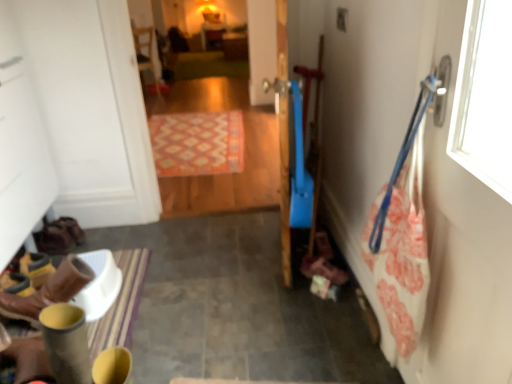
Question: Is wooden chair at upper center thinner than patterned carpet at center?

Choices:
 (A) no
 (B) yes

Answer: (B)

Question: Are wooden chair at upper center and patterned carpet at center located far from each other?

Choices:
 (A) yes
 (B) no

Answer: (A)

Question: From the image's perspective, would you say wooden chair at upper center is positioned over patterned carpet at center?

Choices:
 (A) yes
 (B) no

Answer: (A)

Question: Considering the relative positions of wooden chair at upper center and patterned carpet at center in the image provided, is wooden chair at upper center to the left of patterned carpet at center from the viewer's perspective?

Choices:
 (A) yes
 (B) no

Answer: (A)

Question: Is wooden chair at upper center closer to camera compared to patterned carpet at center?

Choices:
 (A) yes
 (B) no

Answer: (B)

Question: Is wooden chair at upper center placed right next to patterned carpet at center?

Choices:
 (A) no
 (B) yes

Answer: (A)

Question: Is wooden chair at upper center to the left of patterned carpet at center from the viewer's perspective?

Choices:
 (A) yes
 (B) no

Answer: (A)

Question: Is there a large distance between wooden chair at upper center and patterned carpet at center?

Choices:
 (A) no
 (B) yes

Answer: (B)

Question: Can we say wooden chair at upper center lies outside patterned carpet at center?

Choices:
 (A) no
 (B) yes

Answer: (B)

Question: Could you tell me if wooden chair at upper center is turned towards patterned carpet at center?

Choices:
 (A) yes
 (B) no

Answer: (B)

Question: Is wooden chair at upper center smaller than patterned carpet at center?

Choices:
 (A) no
 (B) yes

Answer: (B)

Question: Is wooden chair at upper center further to the viewer compared to patterned carpet at center?

Choices:
 (A) yes
 (B) no

Answer: (A)

Question: Is brown leather boots at lower left bigger than patterned carpet at center?

Choices:
 (A) no
 (B) yes

Answer: (A)